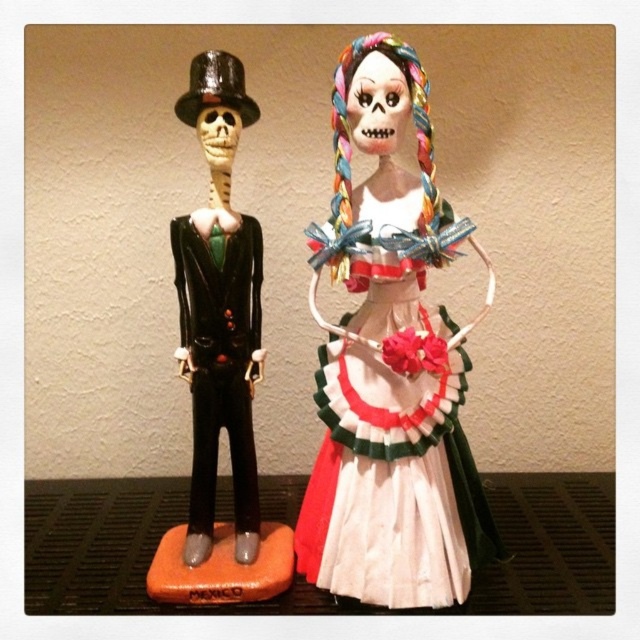
Question: Among these points, which one is nearest to the camera?

Choices:
 (A) (356, 563)
 (B) (412, 408)

Answer: (B)

Question: Which point is closer to the camera taking this photo?

Choices:
 (A) (404, 595)
 (B) (436, 522)

Answer: (A)

Question: Does matte black skeleton at left come in front of white paper dress at center?

Choices:
 (A) yes
 (B) no

Answer: (A)

Question: Can you confirm if matte black skeleton at left is positioned to the left of white paper dress at center?

Choices:
 (A) yes
 (B) no

Answer: (A)

Question: Does matte black skeleton at left lie behind white paper dress at center?

Choices:
 (A) no
 (B) yes

Answer: (A)